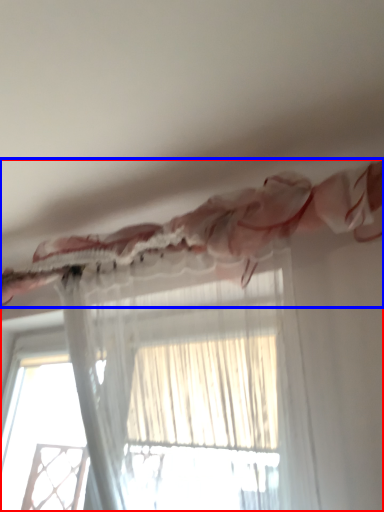
Question: Which object is closer to the camera taking this photo, curtain (highlighted by a red box) or curtain (highlighted by a blue box)?

Choices:
 (A) curtain
 (B) curtain

Answer: (A)